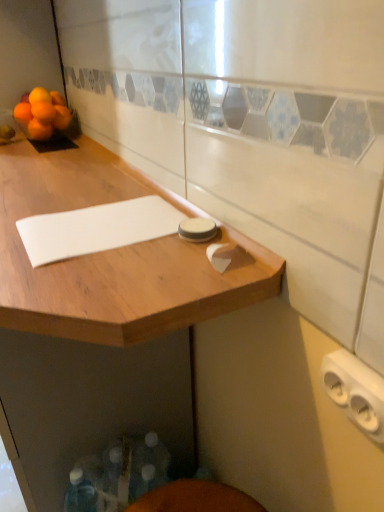
Find the location of `vacant space that is in between white matte notepad at center and orange matte at upper left, which ranks as the first orange in right-to-left order`. vacant space that is in between white matte notepad at center and orange matte at upper left, which ranks as the first orange in right-to-left order is located at coordinates (63, 178).